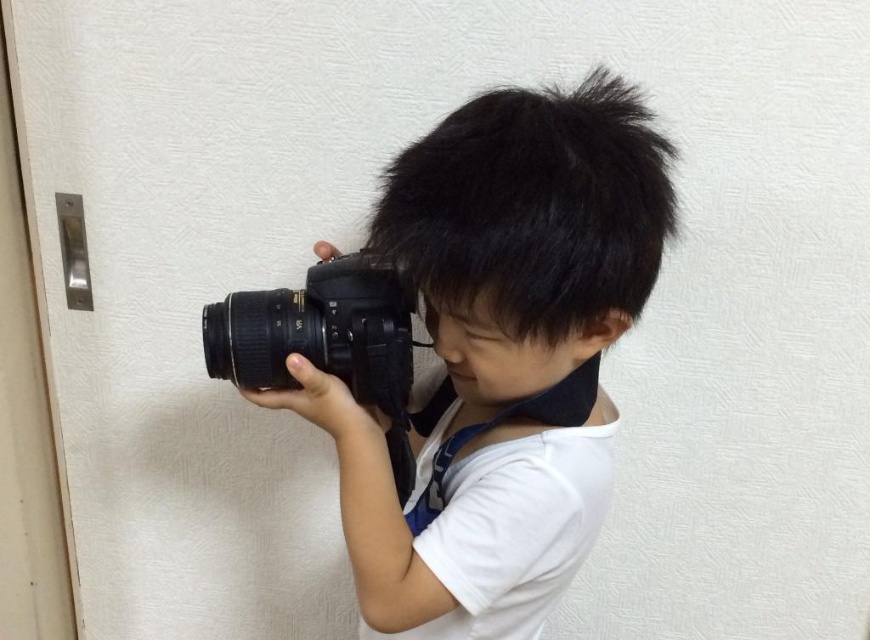
Question: Can you confirm if matte black camera at center is bigger than black rubberized camera at center?

Choices:
 (A) no
 (B) yes

Answer: (B)

Question: Is matte black camera at center behind black rubberized camera at center?

Choices:
 (A) no
 (B) yes

Answer: (A)

Question: Which object is farther from the camera taking this photo?

Choices:
 (A) matte black camera at center
 (B) black rubberized camera at center

Answer: (B)

Question: Does matte black camera at center lie behind black rubberized camera at center?

Choices:
 (A) yes
 (B) no

Answer: (B)

Question: Among these objects, which one is nearest to the camera?

Choices:
 (A) black rubberized camera at center
 (B) matte black camera at center

Answer: (B)

Question: Which object appears closest to the camera in this image?

Choices:
 (A) matte black camera at center
 (B) black rubberized camera at center

Answer: (A)